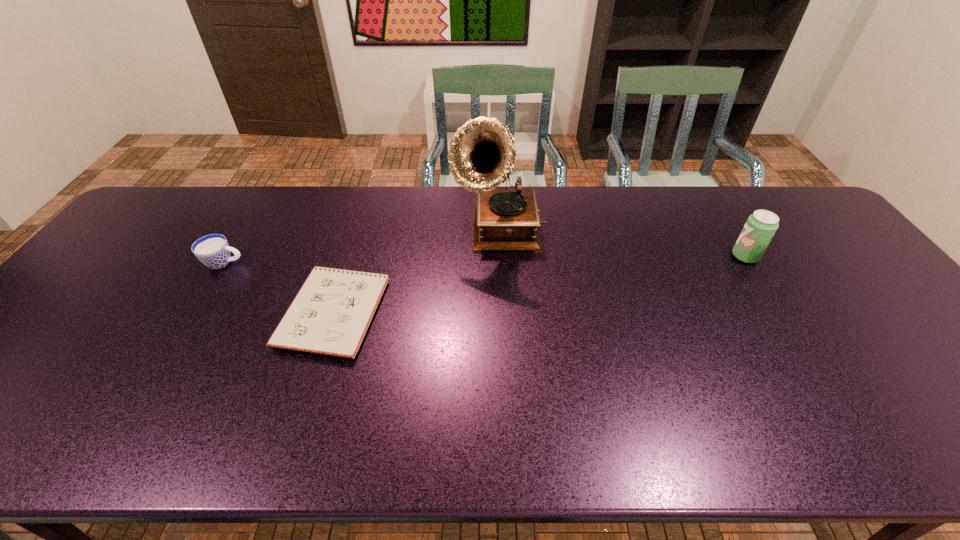
The height and width of the screenshot is (540, 960). Identify the location of free space that is in between the second object from right to left and the notepad. (417, 272).

This screenshot has width=960, height=540. Identify the location of vacant area that lies between the leftmost object and the notepad. (279, 287).

Identify the location of free space between the tallest object and the leftmost object. (362, 248).

Locate an element on the screen. free point between the cup and the soda is located at coordinates (x=485, y=259).

You are a GUI agent. You are given a task and a screenshot of the screen. Output one action in this format:
    pyautogui.click(x=<x>, y=<y>)
    Task: Click on the vacant area that lies between the cup and the second tallest object
    The image size is (960, 540).
    Given the screenshot: What is the action you would take?
    pyautogui.click(x=485, y=259)

You are a GUI agent. You are given a task and a screenshot of the screen. Output one action in this format:
    pyautogui.click(x=<x>, y=<y>)
    Task: Click on the vacant space that's between the third object from left to right and the second tallest object
    This screenshot has width=960, height=540.
    Given the screenshot: What is the action you would take?
    pyautogui.click(x=622, y=245)

Identify the location of vacant area that lies between the notepad and the record player. This screenshot has height=540, width=960. (417, 272).

Image resolution: width=960 pixels, height=540 pixels. What are the coordinates of `free spot between the cup and the second object from left to right` in the screenshot? It's located at (279, 287).

Image resolution: width=960 pixels, height=540 pixels. Find the location of `object that ranks as the third closest to the third tallest object`. object that ranks as the third closest to the third tallest object is located at coordinates (759, 229).

Choose which object is the nearest neighbor to the cup. Please provide its 2D coordinates. Your answer should be formatted as a tuple, i.e. [(x, y)], where the tuple contains the x and y coordinates of a point satisfying the conditions above.

[(330, 315)]